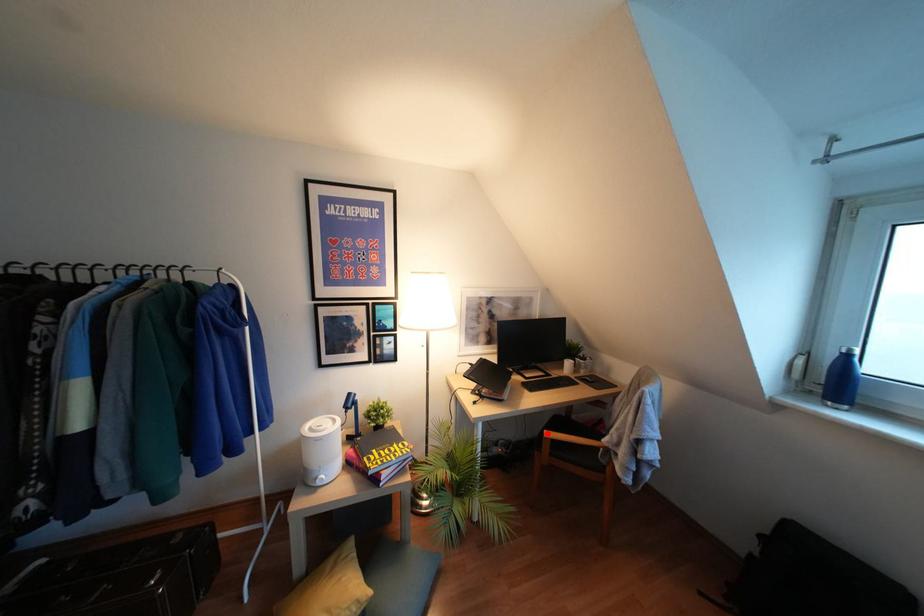
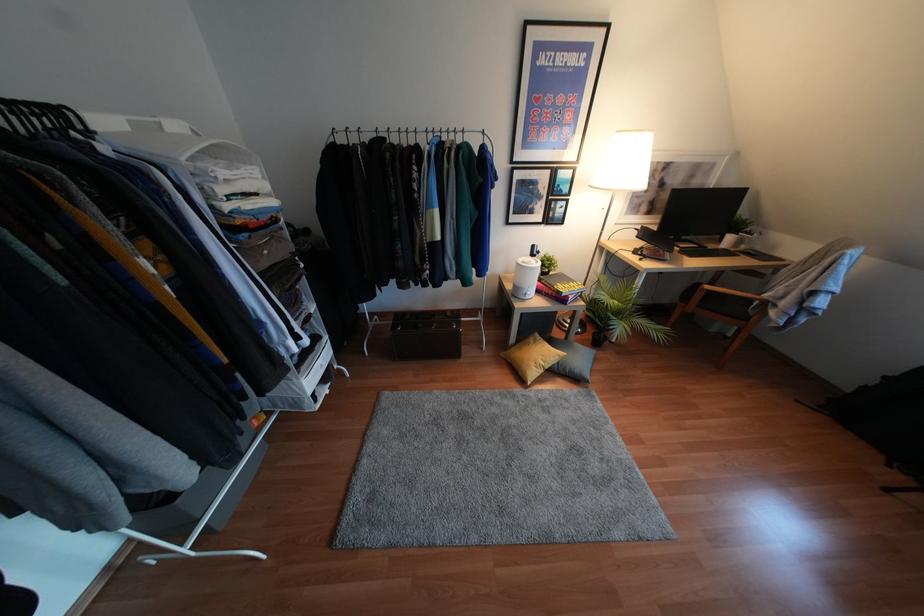
Question: A red point is marked in image1. In image2, is the corresponding 3D point closer to the camera or farther? Reply with the corresponding letter.

Choices:
 (A) The corresponding 3D point is closer.
 (B) The corresponding 3D point is farther.

Answer: (A)